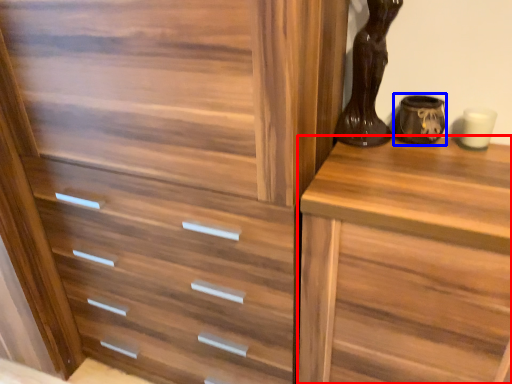
Question: Among these objects, which one is farthest to the camera, chest of drawers (highlighted by a red box) or vase (highlighted by a blue box)?

Choices:
 (A) chest of drawers
 (B) vase

Answer: (B)